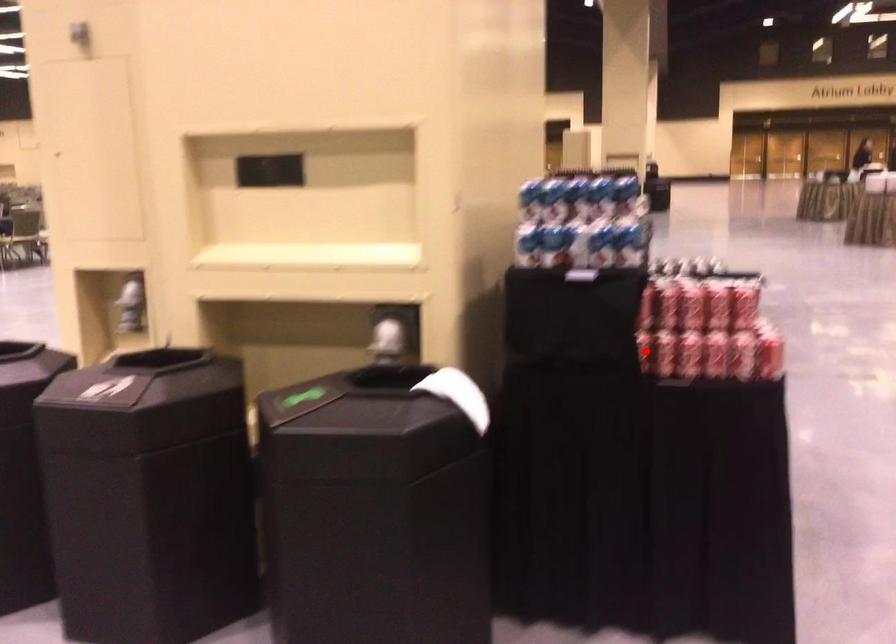
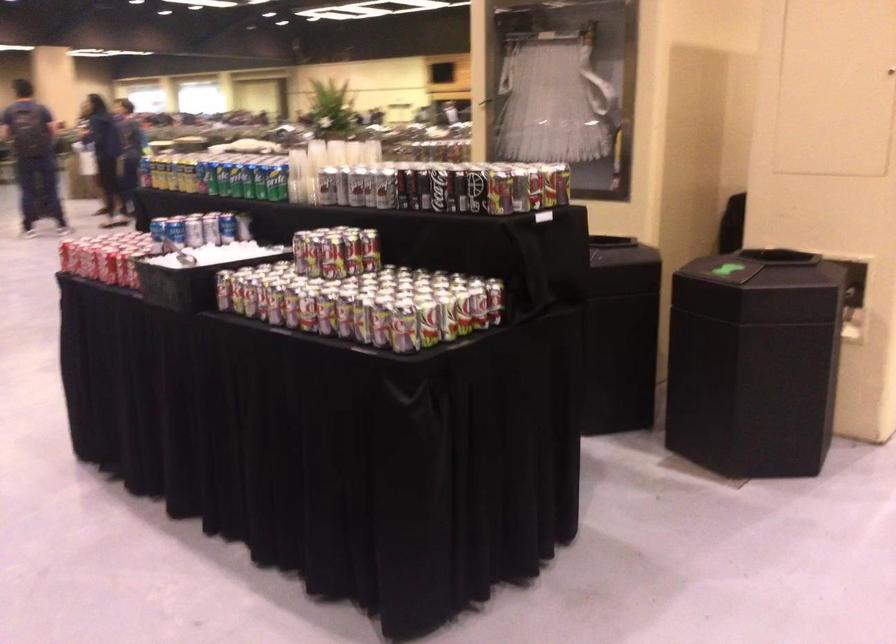
Question: I am providing you with two images of the same scene from different viewpoints. A red point is marked on the first image. At the location where the point appears in image 1, is it still visible in image 2?

Choices:
 (A) Yes
 (B) No

Answer: (B)